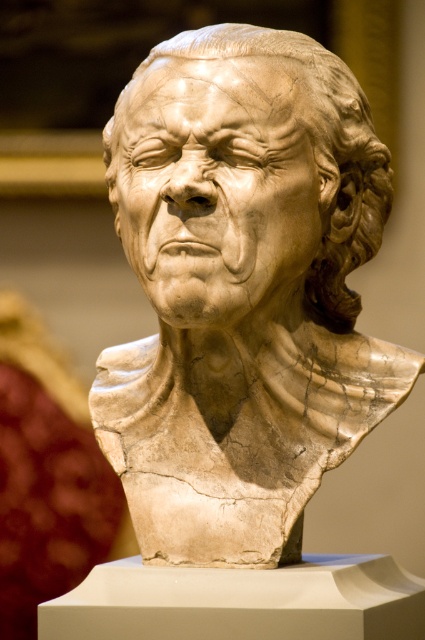
Question: Which object appears farthest from the camera in this image?

Choices:
 (A) marble sculpture at center
 (B) white marble bust at center

Answer: (A)

Question: Can you confirm if white marble bust at center is positioned to the right of marble sculpture at center?

Choices:
 (A) yes
 (B) no

Answer: (B)

Question: From the image, what is the correct spatial relationship of white marble bust at center in relation to marble sculpture at center?

Choices:
 (A) below
 (B) above

Answer: (A)

Question: Among these points, which one is nearest to the camera?

Choices:
 (A) (238, 49)
 (B) (299, 436)

Answer: (A)

Question: In this image, where is white marble bust at center located relative to marble sculpture at center?

Choices:
 (A) above
 (B) below

Answer: (B)